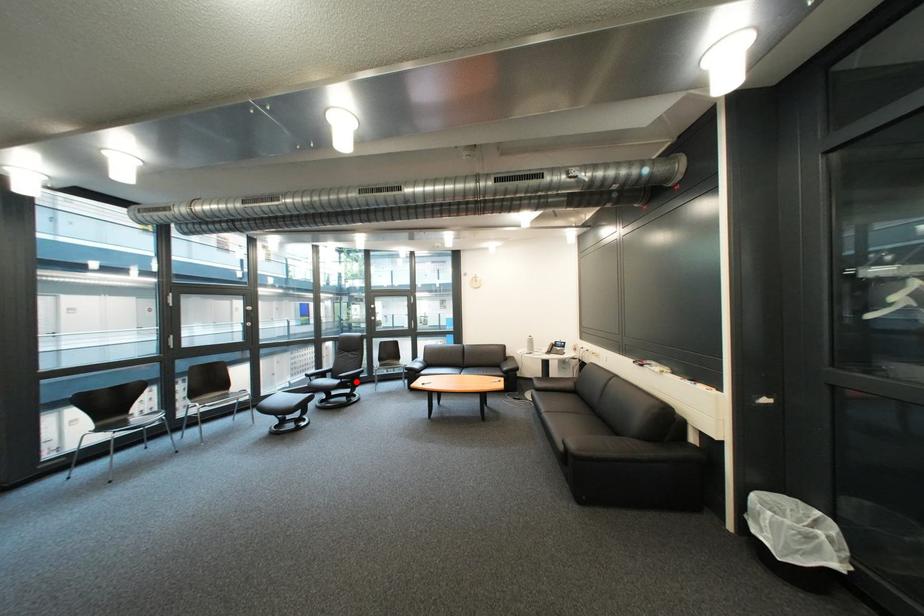
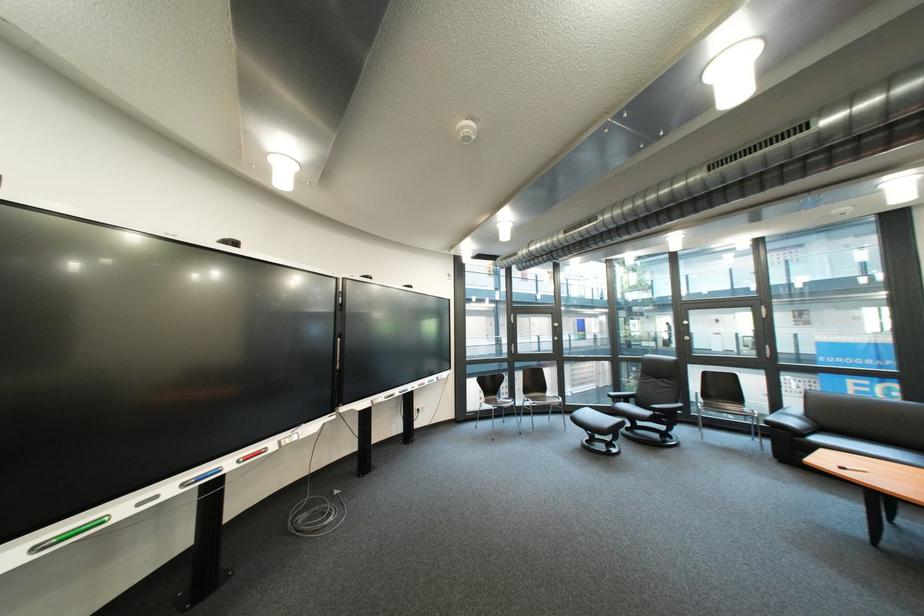
Locate, in the second image, the point that corresponds to the highlighted location in the first image.

(670, 415)